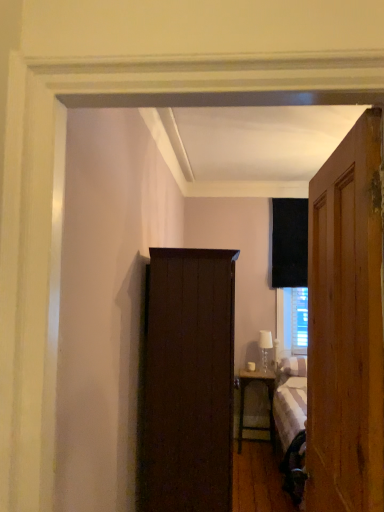
Question: Is wooden door at right not near dark wood cupboard at left?

Choices:
 (A) yes
 (B) no

Answer: (A)

Question: Would you say wooden door at right is outside dark wood cupboard at left?

Choices:
 (A) yes
 (B) no

Answer: (A)

Question: Can you confirm if wooden door at right is smaller than dark wood cupboard at left?

Choices:
 (A) yes
 (B) no

Answer: (A)

Question: Can you confirm if wooden door at right is wider than dark wood cupboard at left?

Choices:
 (A) yes
 (B) no

Answer: (B)

Question: From a real-world perspective, is wooden door at right positioned over dark wood cupboard at left based on gravity?

Choices:
 (A) yes
 (B) no

Answer: (A)

Question: From the image's perspective, would you say wooden door at right is shown under dark wood cupboard at left?

Choices:
 (A) yes
 (B) no

Answer: (B)

Question: Is white glass table lamp at right to the left of wooden door at right from the viewer's perspective?

Choices:
 (A) yes
 (B) no

Answer: (B)

Question: Considering the relative sizes of white glass table lamp at right and wooden door at right in the image provided, is white glass table lamp at right bigger than wooden door at right?

Choices:
 (A) yes
 (B) no

Answer: (B)

Question: Can you see white glass table lamp at right touching wooden door at right?

Choices:
 (A) yes
 (B) no

Answer: (B)

Question: From the image's perspective, is white glass table lamp at right beneath wooden door at right?

Choices:
 (A) yes
 (B) no

Answer: (A)

Question: Is the depth of white glass table lamp at right less than that of wooden door at right?

Choices:
 (A) yes
 (B) no

Answer: (B)

Question: Is white glass table lamp at right behind wooden door at right?

Choices:
 (A) no
 (B) yes

Answer: (B)

Question: From a real-world perspective, does wooden nightstand at right stand above wooden door at right?

Choices:
 (A) no
 (B) yes

Answer: (A)